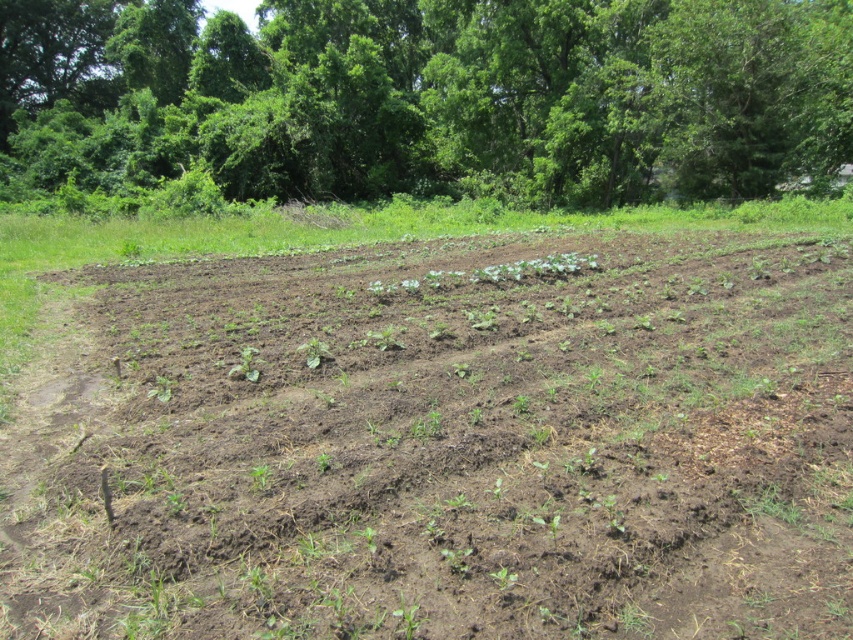
Does brown soil at center have a larger size compared to green leafy trees at upper center?

No, brown soil at center is not bigger than green leafy trees at upper center.

Who is more distant from viewer, (245, 276) or (376, 115)?

Point (376, 115)

What are the coordinates of `brown soil at center` in the screenshot? It's located at (445, 445).